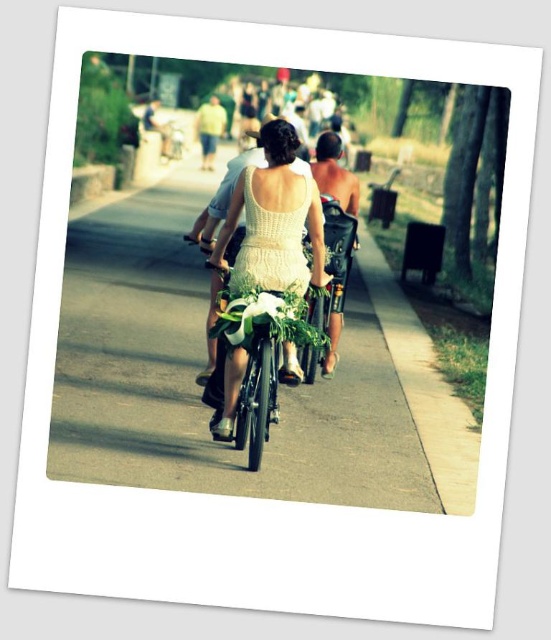
You are a cyclist approaching the scene. You need to determine if there is enough space to safely pass between the smooth asphalt road at center and the light green fabric shirt at center. Can you pass through?

The smooth asphalt road at center is in front of the light green fabric shirt at center, meaning the shirt is behind the road. Since the road is in front, you can safely pass through the smooth asphalt road at center where the light green fabric shirt at center is not obstructing the path.

You are a photographer standing at the edge of the path. You want to take a photo of the light green fabric shirt at center and the smooth tan shirt at upper center. Which shirt should you focus on first to ensure it appears larger in your photo?

The light green fabric shirt at center should be focused on first because it is taller than the smooth tan shirt at upper center, making it appear larger in the photo.